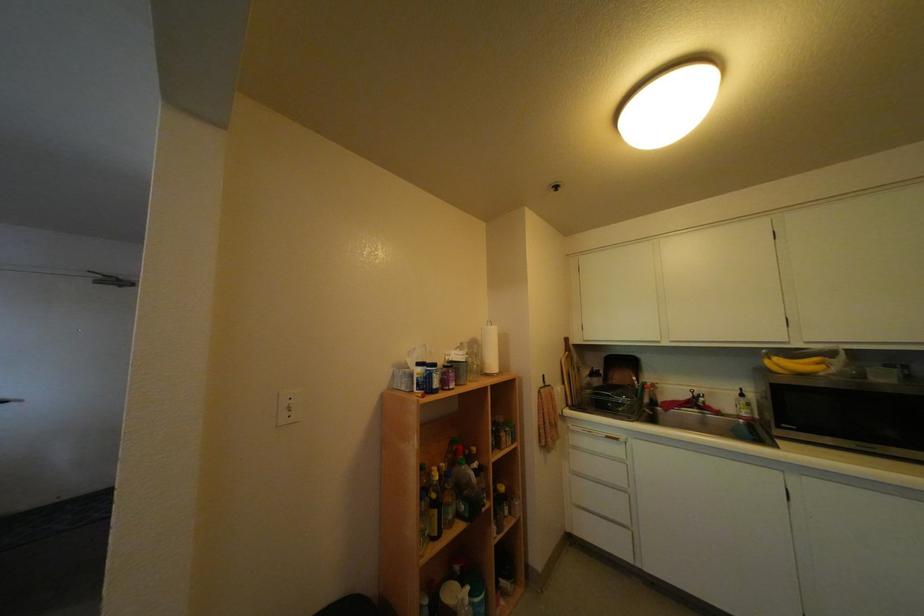
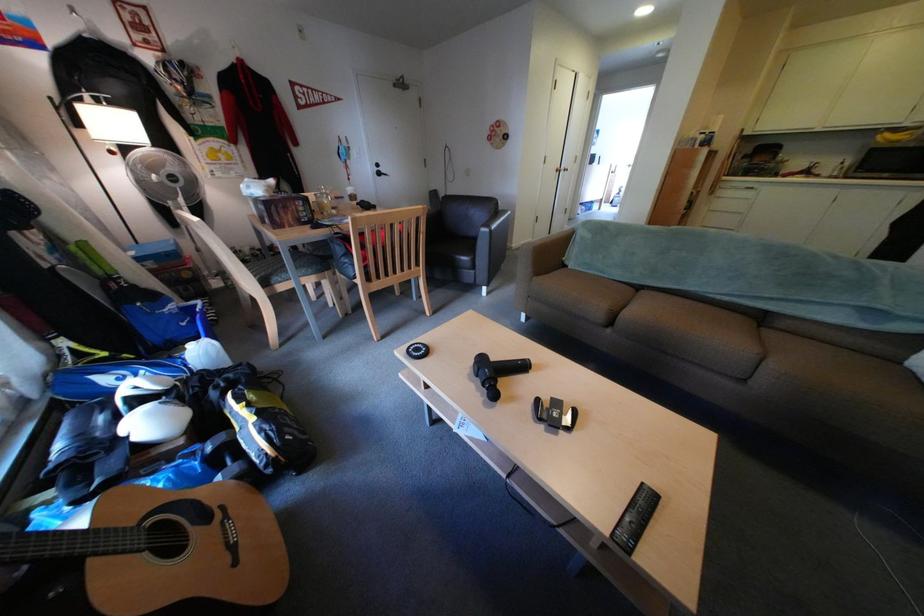
Locate, in the second image, the point that corresponds to (x=781, y=363) in the first image.

(894, 138)